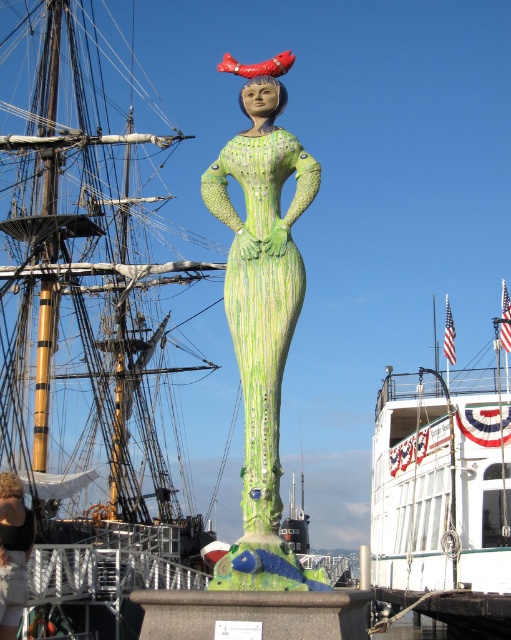
You are standing in front of the sculpture and want to place a small flower pot on the ground near the white glossy boat at lower right. However, you need to ensure that the flower pot won not block the view of the green textured dress at center from where you are standing. Is this possible?

The white glossy boat at lower right is below the green textured dress at center, so placing the flower pot near the boat would not block the view of the dress since the boat is positioned lower and the dress is higher up.

You are an art critic standing in front of the sculpture. You notice the white glossy boat at lower right and the green textured dress at center. Which object is closer to you?

The white glossy boat at lower right is closer to you because the green textured dress at center is behind it.